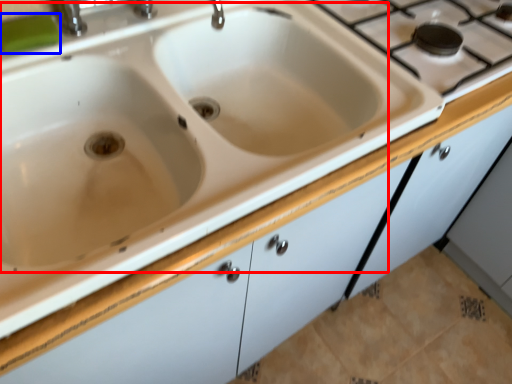
Question: Which of the following is the closest to the observer, sink (highlighted by a red box) or soap (highlighted by a blue box)?

Choices:
 (A) sink
 (B) soap

Answer: (A)